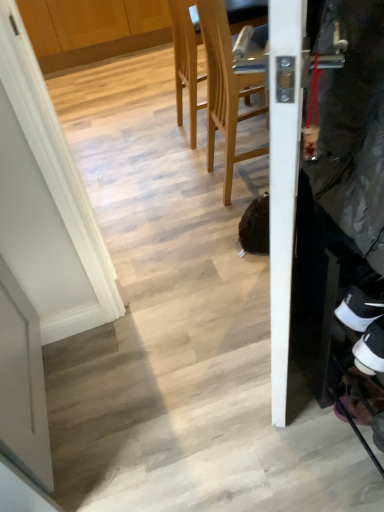
Question: In terms of height, does wooden at center, the 2th chair when ordered from back to front, look taller or shorter compared to light wood chair at upper center, marked as the 1th chair in a back-to-front arrangement?

Choices:
 (A) tall
 (B) short

Answer: (A)

Question: In terms of size, does wooden at center, acting as the first chair starting from the front, appear bigger or smaller than light wood chair at upper center, marked as the 1th chair in a back-to-front arrangement?

Choices:
 (A) big
 (B) small

Answer: (B)

Question: Estimate the real-world distances between objects in this image. Which object is closer to the white suede sneaker at lower right?

Choices:
 (A) light wood chair at upper center, marked as the 1th chair in a back-to-front arrangement
 (B) wooden at center, the 2th chair when ordered from back to front

Answer: (B)

Question: Which of these objects is positioned closest to the wooden at center, acting as the first chair starting from the front?

Choices:
 (A) light wood chair at upper center, marked as the 1th chair in a back-to-front arrangement
 (B) white suede sneaker at lower right

Answer: (A)